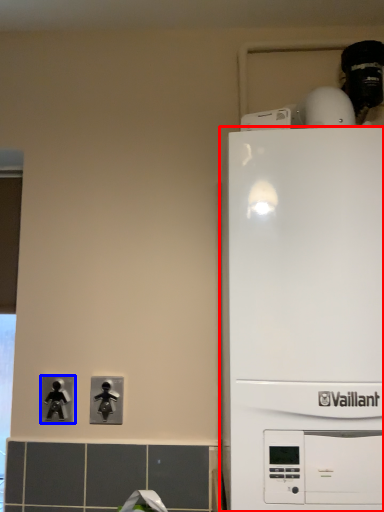
Question: Among these objects, which one is farthest to the camera, home appliance (highlighted by a red box) or light switch (highlighted by a blue box)?

Choices:
 (A) home appliance
 (B) light switch

Answer: (B)